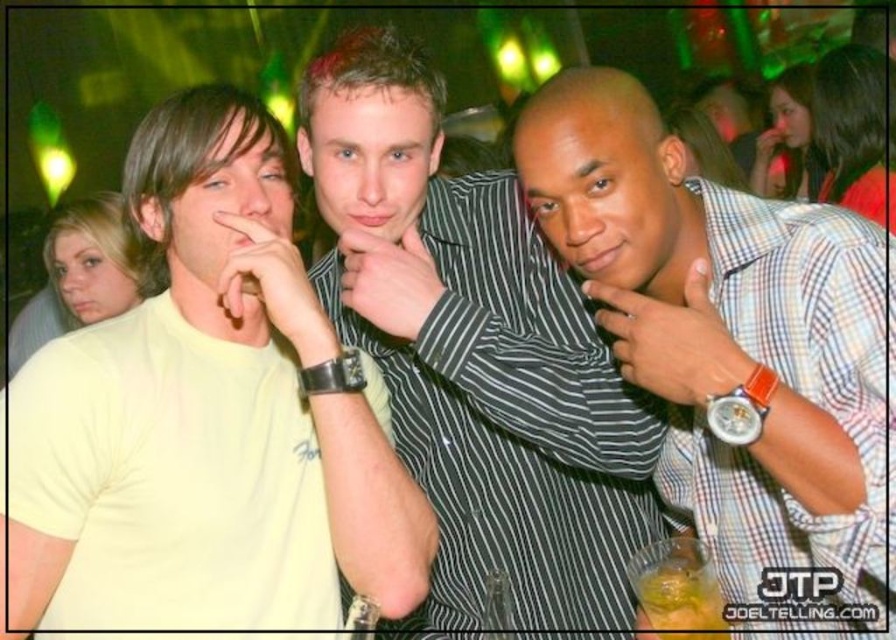
Question: Which object is the farthest from the plaid shirt at center?

Choices:
 (A) translucent plastic cup at center
 (B) striped shirt at center

Answer: (A)

Question: Which point is closer to the camera?

Choices:
 (A) (314, 596)
 (B) (696, 588)
 (C) (513, 227)
 (D) (757, 500)

Answer: (D)

Question: Is striped shirt at center above translucent plastic cup at center?

Choices:
 (A) no
 (B) yes

Answer: (B)

Question: Which of these objects is positioned closest to the striped shirt at center?

Choices:
 (A) plaid shirt at center
 (B) translucent plastic cup at center

Answer: (A)

Question: In this image, where is striped shirt at center located relative to translucent plastic cup at center?

Choices:
 (A) right
 (B) left

Answer: (B)

Question: In this image, where is striped shirt at center located relative to translucent plastic cup at center?

Choices:
 (A) right
 (B) left

Answer: (B)